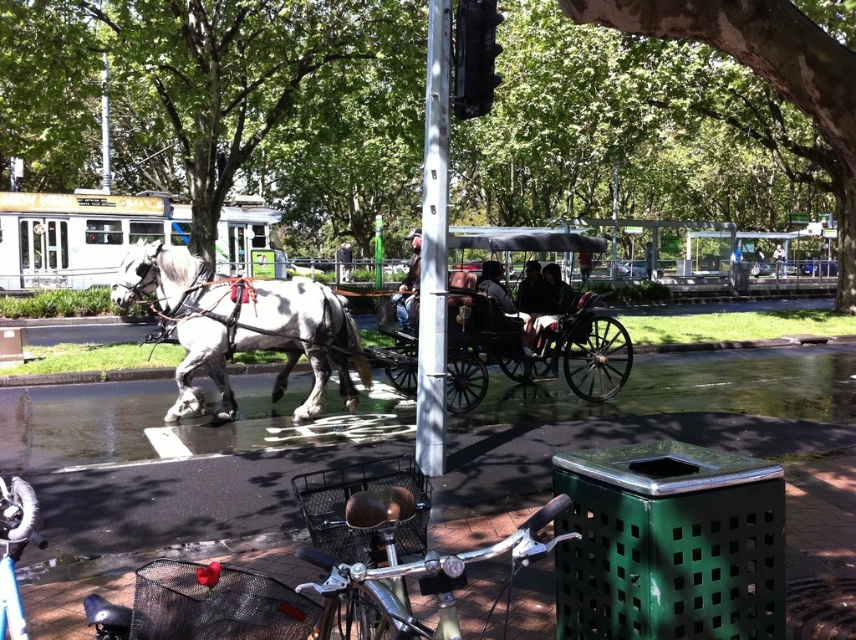
Based on the photo, is wooden polished cart at center bigger than wooden coach at center?

No, wooden polished cart at center is not bigger than wooden coach at center.

Identify the location of wooden polished cart at center. Image resolution: width=856 pixels, height=640 pixels. (532, 344).

Where is `wooden polished cart at center`? The height and width of the screenshot is (640, 856). wooden polished cart at center is located at coordinates (532, 344).

Does gray glossy horse at center have a smaller size compared to wooden polished cart at center?

Correct, gray glossy horse at center occupies less space than wooden polished cart at center.

In the scene shown: Who is positioned more to the left, gray glossy horse at center or wooden polished cart at center?

Positioned to the left is gray glossy horse at center.

Who is more distant from viewer, (241, 348) or (461, 323)?

The point (461, 323) is behind.

Find the location of `gray glossy horse at center`. gray glossy horse at center is located at coordinates (241, 324).

Does gray glossy horse at center lie in front of wooden coach at center?

Yes, gray glossy horse at center is in front of wooden coach at center.

Is gray glossy horse at center bigger than wooden coach at center?

No, gray glossy horse at center is not bigger than wooden coach at center.

Is point (179, 250) in front of point (401, 300)?

Yes, it is.

Identify the location of gray glossy horse at center. (241, 324).